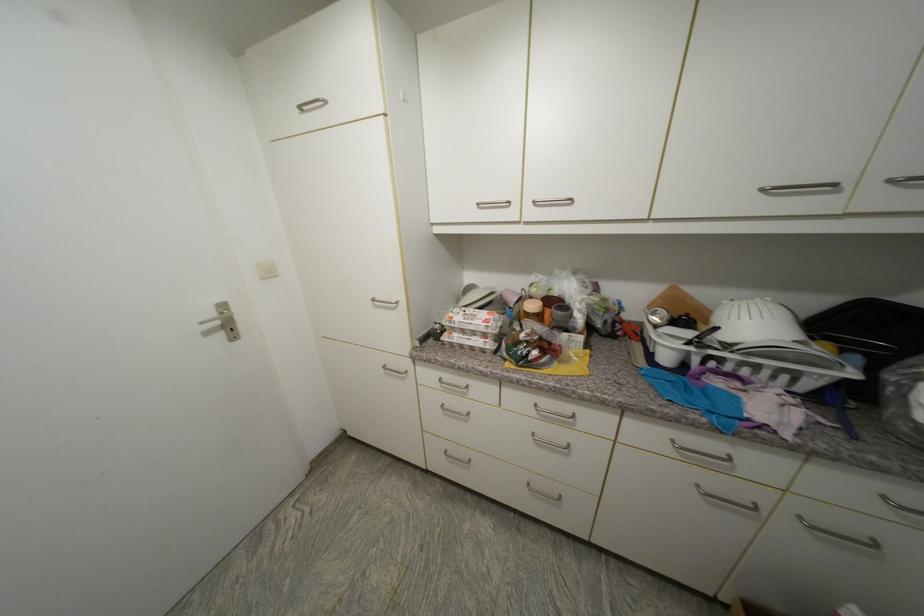
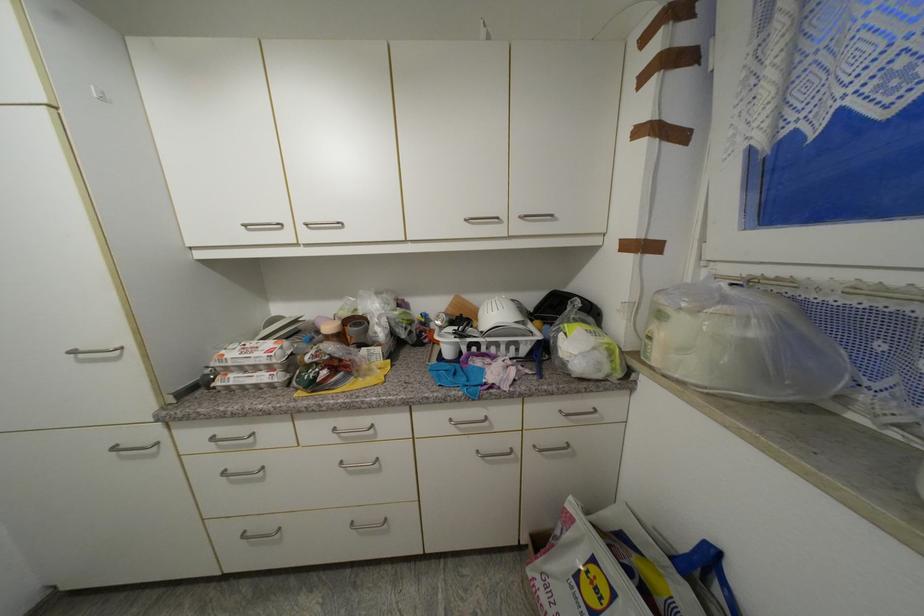
Question: The first image is from the beginning of the video and the second image is from the end. How did the camera likely rotate when shooting the video?

Choices:
 (A) Left
 (B) Right
 (C) Up
 (D) Down

Answer: (B)